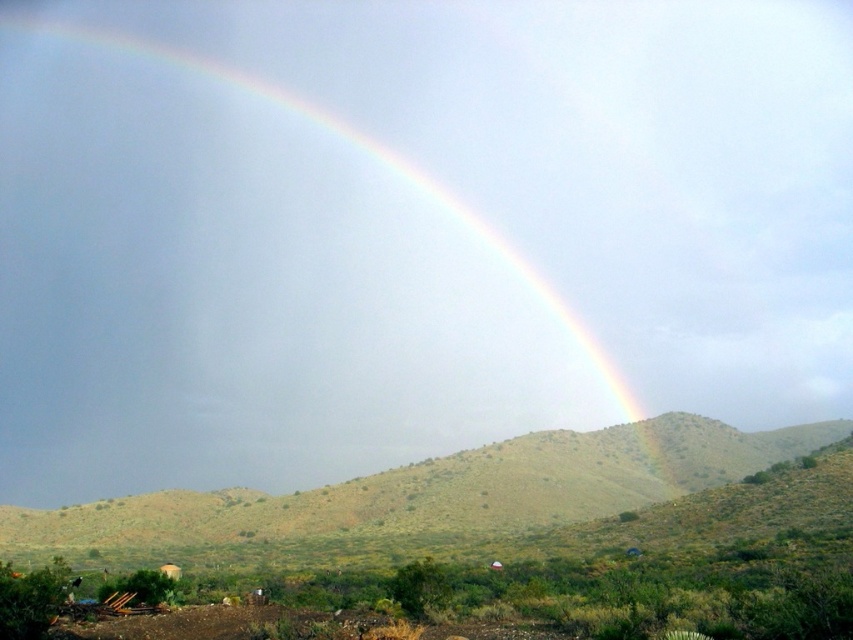
You are standing at the green grassy hillside at lower center and want to take a photo of the rainbow at upper center. In which direction should you point your camera?

You should point your camera to the left because the rainbow at upper center is located to the left of the green grassy hillside at lower center.

You are an artist planning to paint this landscape. You want to ensure the rainbow at upper center and the green grassy hillside at lower center are proportionally accurate. Which object should you make wider in your painting?

The rainbow at upper center should be made wider in the painting since its width is larger than the green grassy hillside at lower center according to the description.